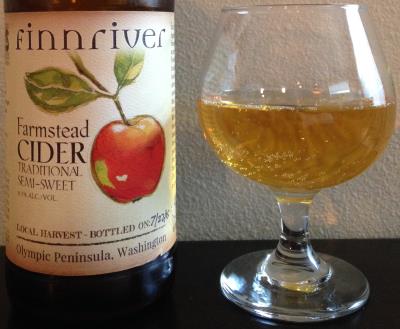
Find the location of a particular element. Image resolution: width=400 pixels, height=329 pixels. handle is located at coordinates (303, 201).